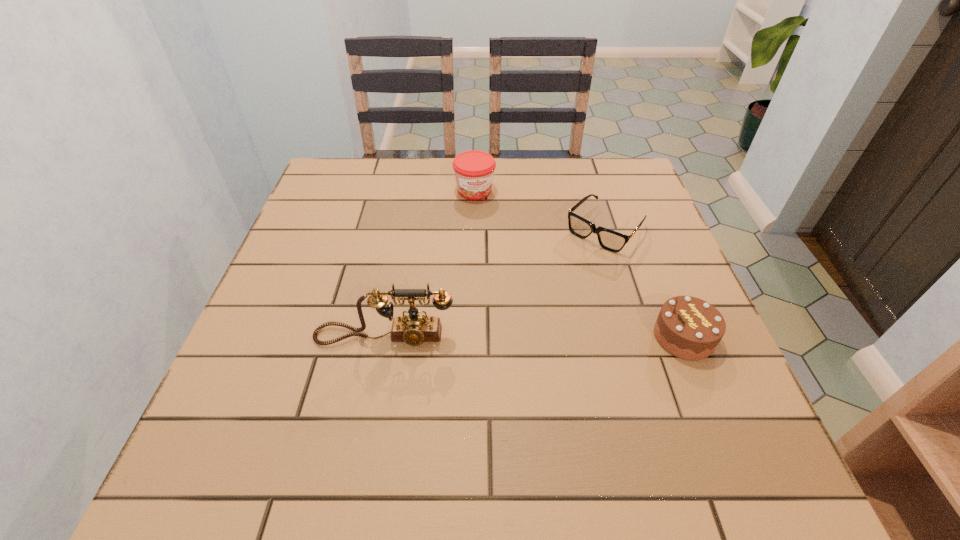
What are the coordinates of `free space at the right edge` in the screenshot? It's located at (629, 205).

Locate an element on the screen. This screenshot has height=540, width=960. blank space at the far left corner of the desktop is located at coordinates (349, 165).

Where is `free space at the far right corner of the desktop`? free space at the far right corner of the desktop is located at coordinates (584, 163).

I want to click on vacant area that lies between the chocolate cake and the shortest object, so click(x=644, y=283).

Where is `unoccupied position between the chocolate cake and the shortest object`? unoccupied position between the chocolate cake and the shortest object is located at coordinates pyautogui.click(x=644, y=283).

Where is `vacant area between the chocolate cake and the sunglasses`? This screenshot has height=540, width=960. vacant area between the chocolate cake and the sunglasses is located at coordinates (644, 283).

Identify the location of vacant space that is in between the tallest object and the chocolate cake. The image size is (960, 540). (534, 336).

I want to click on vacant space in between the tallest object and the chocolate cake, so click(534, 336).

Locate an element on the screen. Image resolution: width=960 pixels, height=540 pixels. vacant area that lies between the chocolate cake and the telephone is located at coordinates (534, 336).

I want to click on free space between the farthest object and the chocolate cake, so click(579, 264).